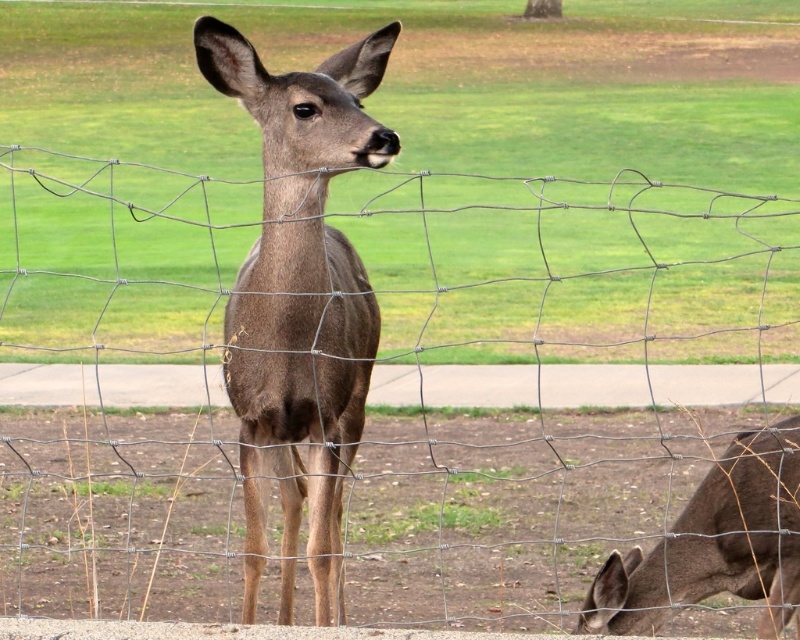
Can you confirm if brown matte roe deer at center is positioned above brown matte/deer at lower right?

Yes, brown matte roe deer at center is above brown matte/deer at lower right.

Is brown matte roe deer at center behind brown matte/deer at lower right?

No.

Who is more forward, (250, 611) or (620, 579)?

Positioned in front is point (250, 611).

The width and height of the screenshot is (800, 640). Identify the location of brown matte roe deer at center. (300, 300).

Which is below, green grass at center or brown matte/deer at lower right?

brown matte/deer at lower right is below.

Can you confirm if green grass at center is positioned to the left of brown matte/deer at lower right?

Yes, green grass at center is to the left of brown matte/deer at lower right.

Identify the location of green grass at center. This screenshot has width=800, height=640. (416, 177).

Does green grass at center appear on the left side of brown matte roe deer at center?

Incorrect, green grass at center is not on the left side of brown matte roe deer at center.

Is point (188, 163) in front of point (336, 333)?

No, (188, 163) is further to viewer.

Where is `green grass at center`? green grass at center is located at coordinates pos(416,177).